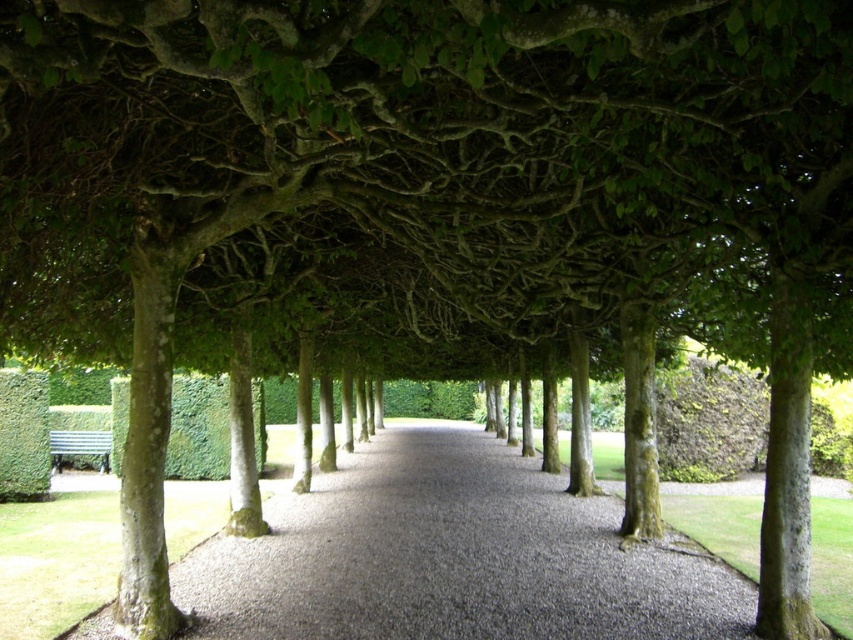
Consider the image. You are planning to place a new garden statue that is 1.2 meters tall. You want to ensure it is visible from the entrance of the garden. Considering the smooth gravel path at center and the metallic silver bench at lower left, which object would be the better location for the statue to ensure visibility?

The metallic silver bench at lower left is taller than the smooth gravel path at center, so placing the statue on the bench would provide better visibility from the entrance.

You are a gardener who needs to move a 20 feet long hose from the metallic silver bench at lower left to the smooth gravel path at center. Can you lay the hose directly between them without bending it?

The smooth gravel path at center and metallic silver bench at lower left are 22.92 feet apart from each other. Since the hose is 20 feet long, it is shorter than the distance between them, so you cannot lay the hose directly without bending it.